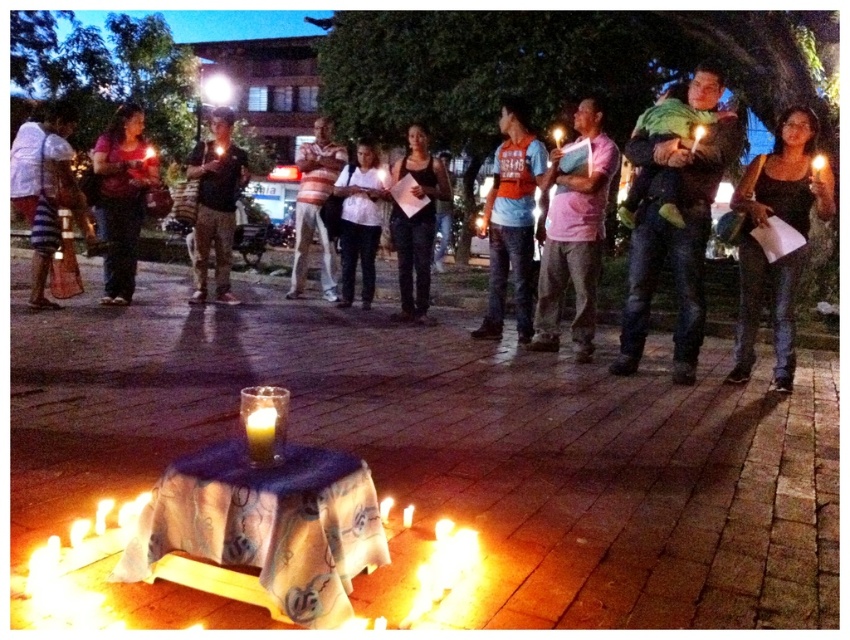
Question: Is pink cotton shirt at center above striped fabric bag at left?

Choices:
 (A) no
 (B) yes

Answer: (A)

Question: Among these objects, which one is nearest to the camera?

Choices:
 (A) green knitted scarf at center
 (B) translucent glass candle at lower left
 (C) orange fabric shirt at center

Answer: (B)

Question: Is pink cotton shirt at center wider than yellow wax candle at center?

Choices:
 (A) no
 (B) yes

Answer: (B)

Question: Considering the real-world distances, which object is farthest from the striped fabric bag at left?

Choices:
 (A) matte black shirt at left
 (B) white matte shirt at center

Answer: (B)

Question: Which of the following is the closest to the observer?

Choices:
 (A) (105, 502)
 (B) (809, 189)
 (C) (814, 179)
 (D) (703, 129)

Answer: (A)

Question: Does white wax candle at lower center appear over translucent glass candle at center?

Choices:
 (A) no
 (B) yes

Answer: (A)